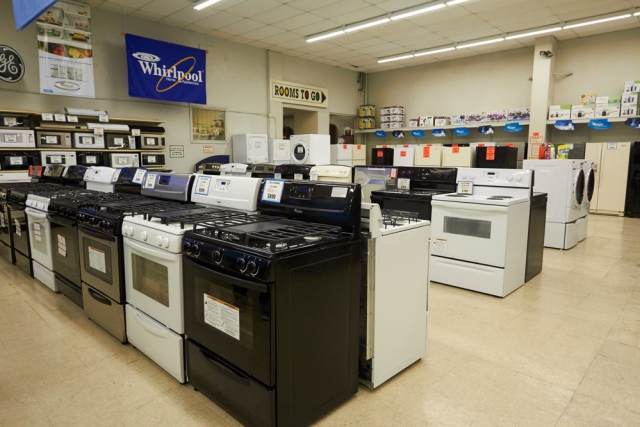
Locate an element on the screen. The height and width of the screenshot is (427, 640). floor is located at coordinates (591, 271), (550, 352), (476, 408), (86, 409), (32, 339).